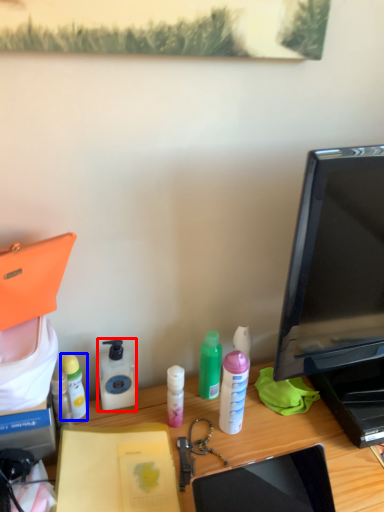
Question: Which object appears farthest to the camera in this image, bottle (highlighted by a red box) or bottle (highlighted by a blue box)?

Choices:
 (A) bottle
 (B) bottle

Answer: (A)